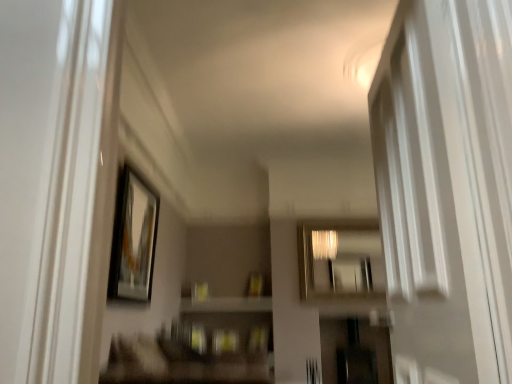
Question: Considering the positions of matte black picture frame at upper left and metallic reflective mirror at center in the image, is matte black picture frame at upper left taller or shorter than metallic reflective mirror at center?

Choices:
 (A) short
 (B) tall

Answer: (B)

Question: Considering the positions of matte black picture frame at upper left and metallic reflective mirror at center in the image, is matte black picture frame at upper left bigger or smaller than metallic reflective mirror at center?

Choices:
 (A) big
 (B) small

Answer: (B)

Question: Which object is positioned farthest from the matte black picture frame at upper left?

Choices:
 (A) metallic reflective mirror at center
 (B) white glossy screen door at right

Answer: (A)

Question: Estimate the real-world distances between objects in this image. Which object is closer to the matte black picture frame at upper left?

Choices:
 (A) white glossy screen door at right
 (B) metallic reflective mirror at center

Answer: (A)